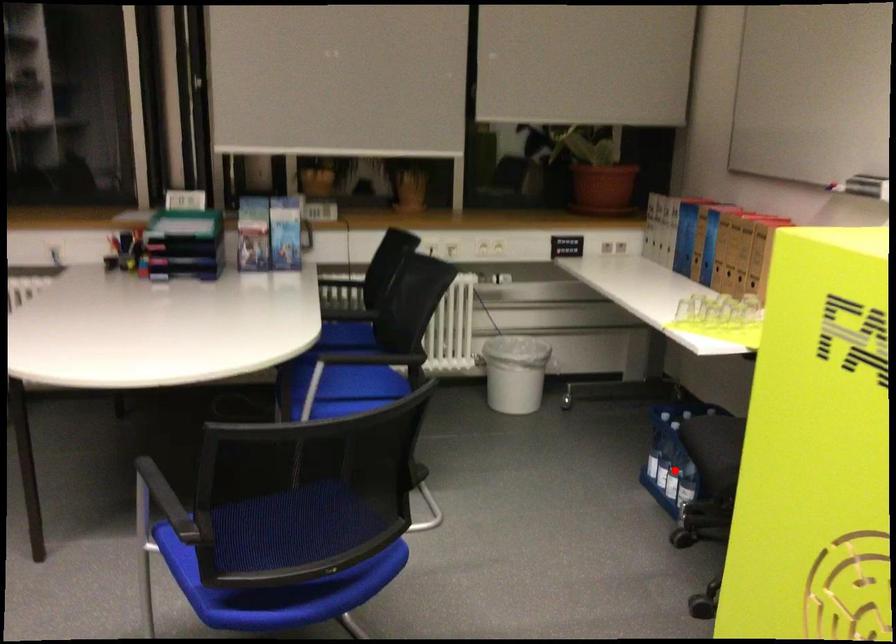
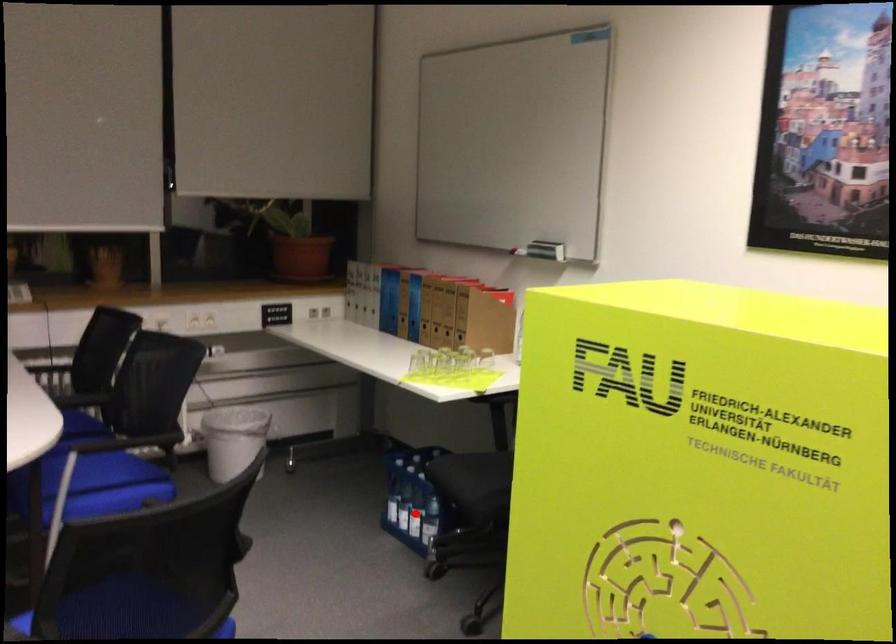
I am providing you with two images of the same scene from different viewpoints. A red point is marked on the first image and another point is marked on the second image. Do the highlighted points in image1 and image2 indicate the same real-world spot?

Yes